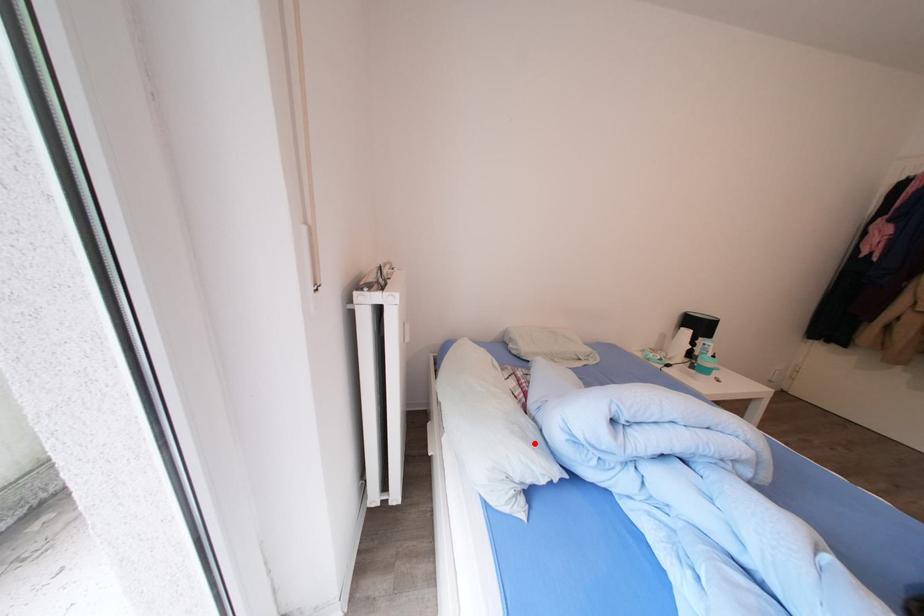
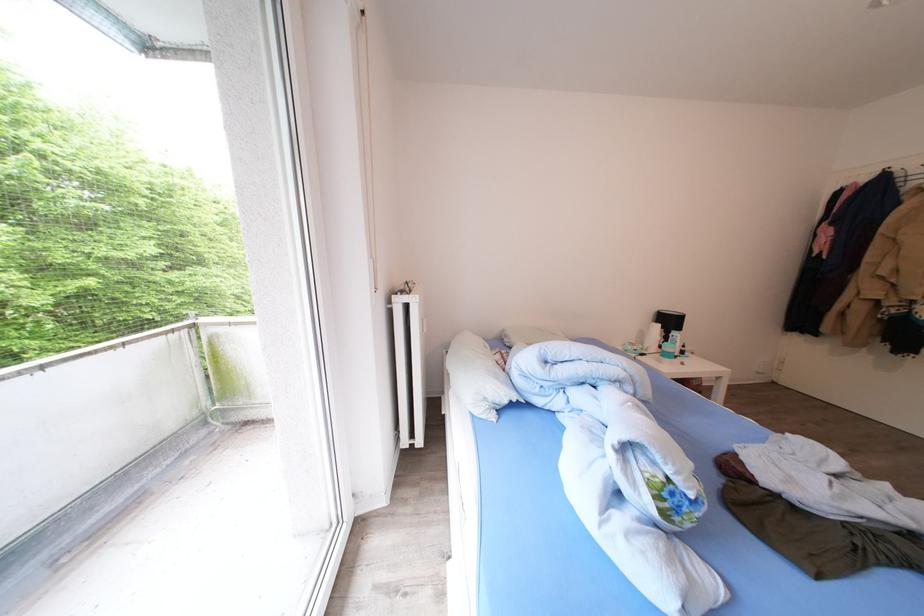
In the second image, find the point that corresponds to the highlighted location in the first image.

(505, 383)